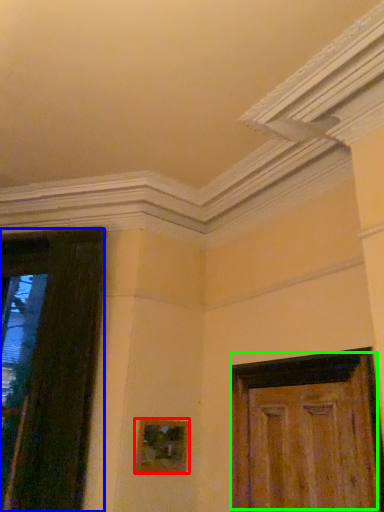
Question: Which object is positioned farthest from picture frame (highlighted by a red box)? Select from door (highlighted by a blue box) and door (highlighted by a green box).

Choices:
 (A) door
 (B) door

Answer: (B)